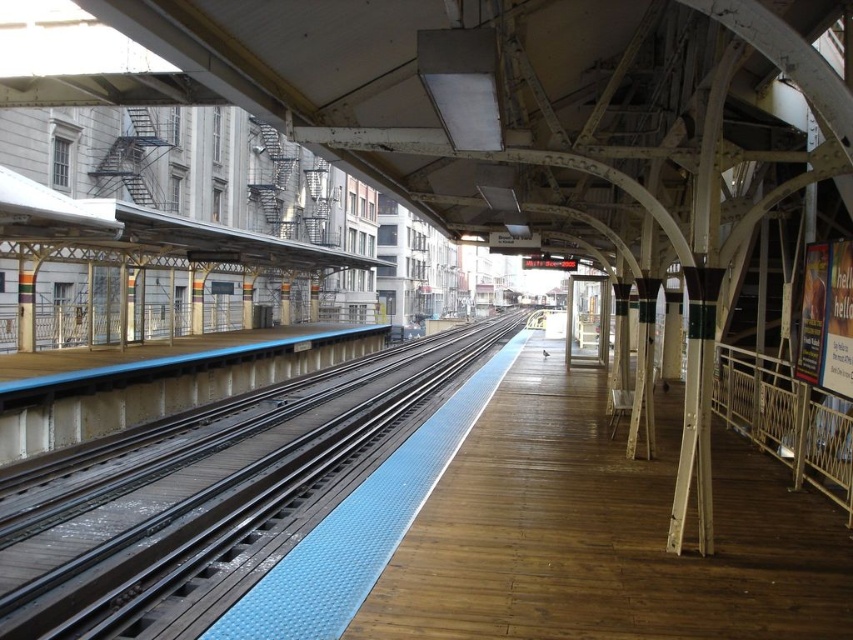
Based on the photo, you are standing at the point labeled as point (x=602, y=534) on the train station platform. Based on the scene description, which object are you currently standing on?

The point (x=602, y=534) corresponds to the wooden platform at center, so you are standing on the wooden platform at center.

You are standing at the entrance of the train station and want to reach the wooden platform at center. According to the coordinates given, in which direction should you move relative to your current position?

The wooden platform at center is located at coordinates point [602,534], so you should move towards the direction of increasing x and y coordinates to reach it.